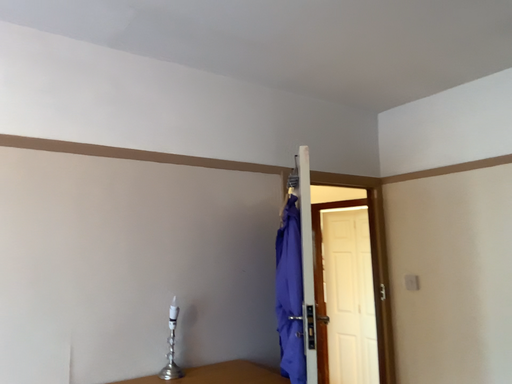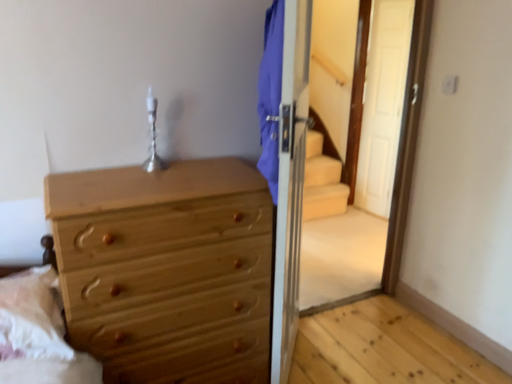
Question: How did the camera likely rotate when shooting the video?

Choices:
 (A) rotated upward
 (B) rotated downward

Answer: (B)